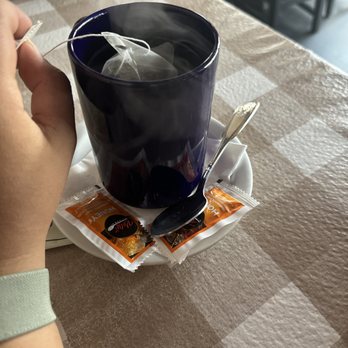
Where is `small plate`? The image size is (348, 348). small plate is located at coordinates (244, 175).